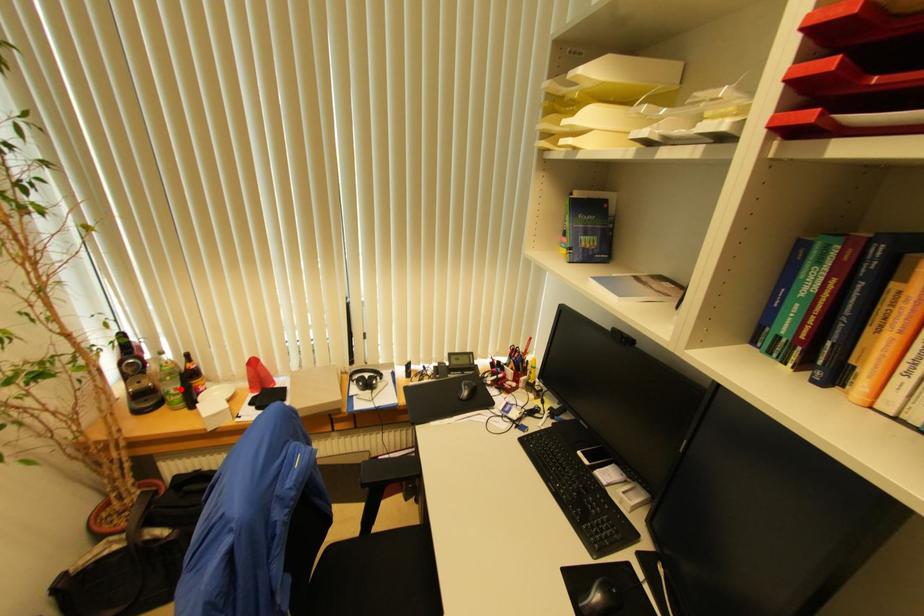
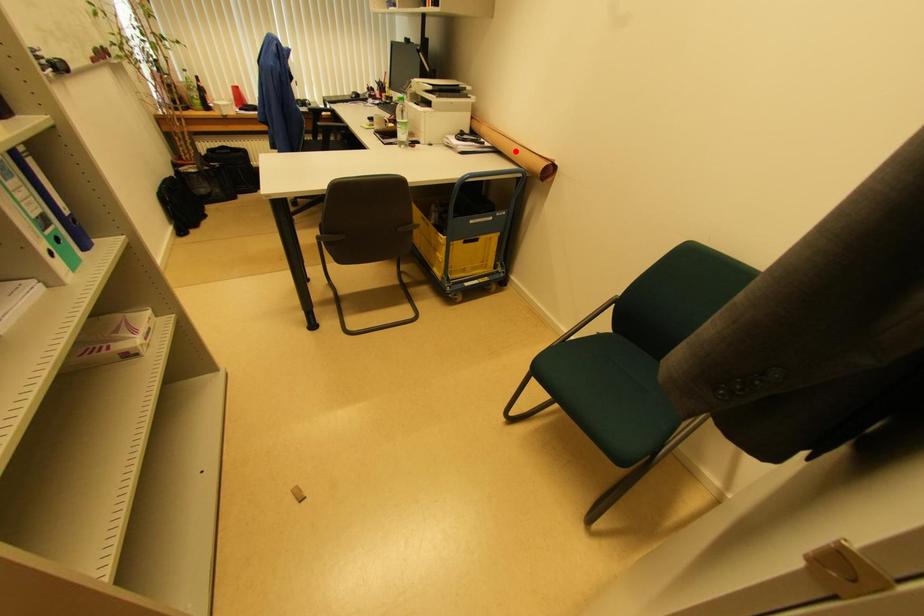
I am providing you with two images of the same scene from different viewpoints. A red point is marked on the first image and another point is marked on the second image. Is the marked point in image1 the same physical position as the marked point in image2?

No